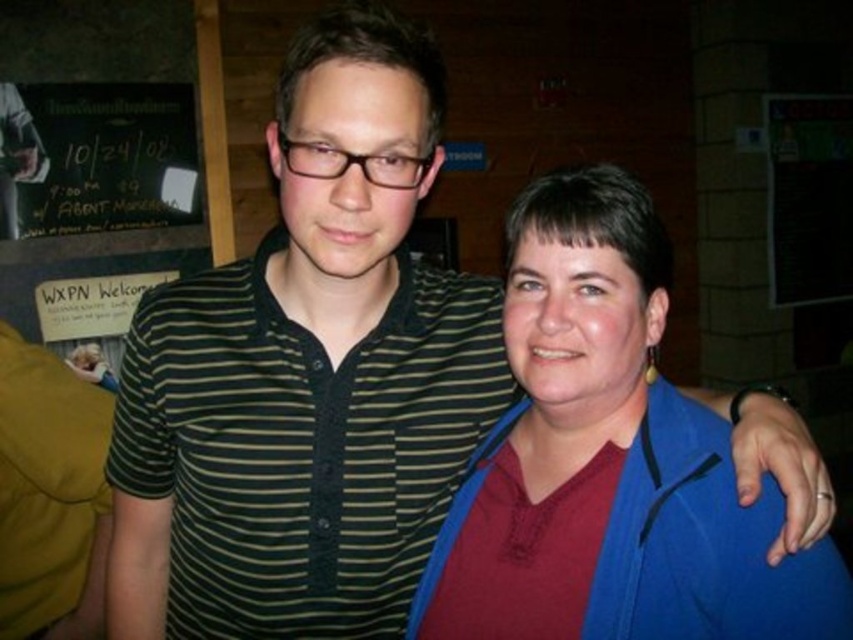
Question: Which of the following is the farthest from the observer?

Choices:
 (A) (39, 296)
 (B) (440, 547)

Answer: (A)

Question: Can you confirm if maroon fabric shirt at center is positioned to the left of black chalkboard at upper left?

Choices:
 (A) yes
 (B) no

Answer: (B)

Question: Which of the following is the farthest from the observer?

Choices:
 (A) maroon fabric shirt at center
 (B) black chalkboard at upper left

Answer: (B)

Question: Is maroon fabric shirt at center bigger than black chalkboard at upper left?

Choices:
 (A) no
 (B) yes

Answer: (A)

Question: Which point is farther to the camera?

Choices:
 (A) black chalkboard at upper left
 (B) maroon fabric shirt at center

Answer: (A)

Question: Can you confirm if maroon fabric shirt at center is smaller than black chalkboard at upper left?

Choices:
 (A) no
 (B) yes

Answer: (B)